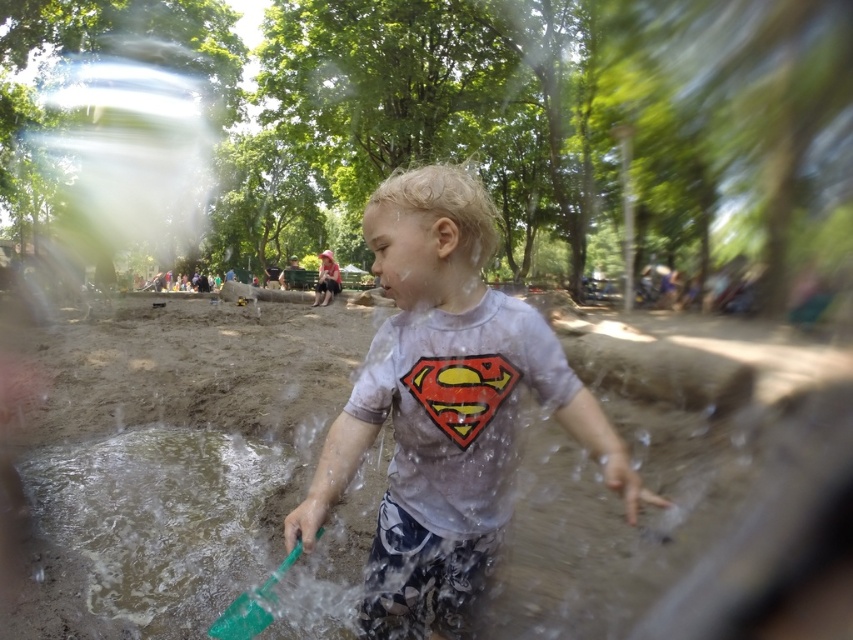
You are a photographer trying to capture the child in the center of the image. The child is wearing a light gray T shirt with a Superman logo and is holding a green plastic shovel. There is a point at coordinate (x=445, y=406). What is located at that point?

The point at coordinate (x=445, y=406) is occupied by the matte gray t shirt at center.